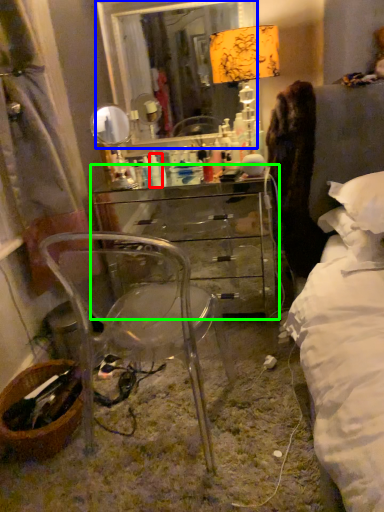
Question: Based on their relative distances, which object is nearer to toiletry (highlighted by a red box)? Choose from mirror (highlighted by a blue box) and chest of drawers (highlighted by a green box).

Choices:
 (A) mirror
 (B) chest of drawers

Answer: (B)